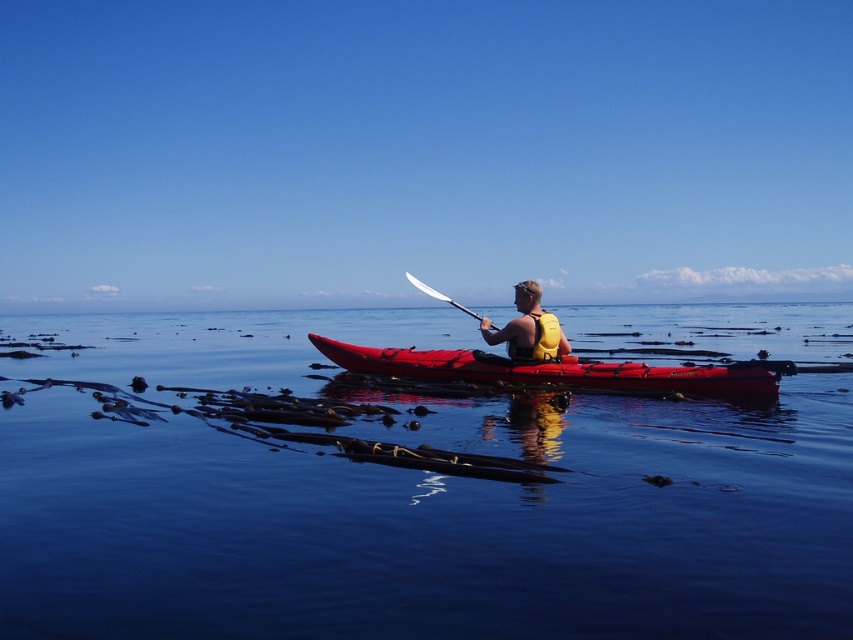
Can you confirm if yellow life vest at center is positioned to the right of white plastic paddle at center?

Yes, yellow life vest at center is to the right of white plastic paddle at center.

Between yellow life vest at center and white plastic paddle at center, which one is positioned higher?

white plastic paddle at center

Which is in front, point (519, 304) or point (442, 298)?

Point (519, 304)

This screenshot has width=853, height=640. In order to click on yellow life vest at center in this screenshot , I will do `click(527, 326)`.

The height and width of the screenshot is (640, 853). I want to click on transparent water at center, so click(407, 500).

Can you confirm if transparent water at center is smaller than white plastic paddle at center?

Incorrect, transparent water at center is not smaller in size than white plastic paddle at center.

Who is more forward, (x=7, y=332) or (x=440, y=294)?

Point (x=440, y=294) is in front.

You are a GUI agent. You are given a task and a screenshot of the screen. Output one action in this format:
    pyautogui.click(x=<x>, y=<y>)
    Task: Click on the transparent water at center
    This screenshot has width=853, height=640.
    Given the screenshot: What is the action you would take?
    pyautogui.click(x=407, y=500)

Can you confirm if transparent water at center is shorter than matte red kayak at center?

In fact, transparent water at center may be taller than matte red kayak at center.

Between transparent water at center and matte red kayak at center, which one has less height?

matte red kayak at center

You are a GUI agent. You are given a task and a screenshot of the screen. Output one action in this format:
    pyautogui.click(x=<x>, y=<y>)
    Task: Click on the transparent water at center
    The width and height of the screenshot is (853, 640).
    Given the screenshot: What is the action you would take?
    pyautogui.click(x=407, y=500)